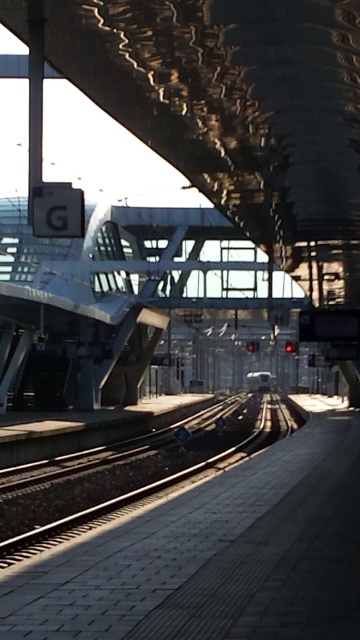
Consider the image. You are waiting on the platform and want to board the metallic silver train at center. However, there is a smooth concrete track at center between you and the train. Can you step over the track to reach the train directly?

The smooth concrete track at center is closer to the viewer than the metallic silver train at center, so you cannot step over the track to reach the train directly because the track is in front of the train from your perspective.

You are a maintenance worker needing to place a 2 meter wide equipment on the platform. The equipment must be placed between the smooth concrete track at center and the metallic silver train at center. Can you fit the equipment there?

The smooth concrete track at center is wider than the metallic silver train at center. Therefore, the equipment cannot be placed between them because the track is wider than the train, leaving insufficient space for a 2 meter wide equipment.

Based on the photo, you are a maintenance worker needing to inspect the height difference between the smooth concrete track at center and the metallic silver train at center. Based on the scene, which one is taller?

The smooth concrete track at center is much taller than the metallic silver train at center according to the description.